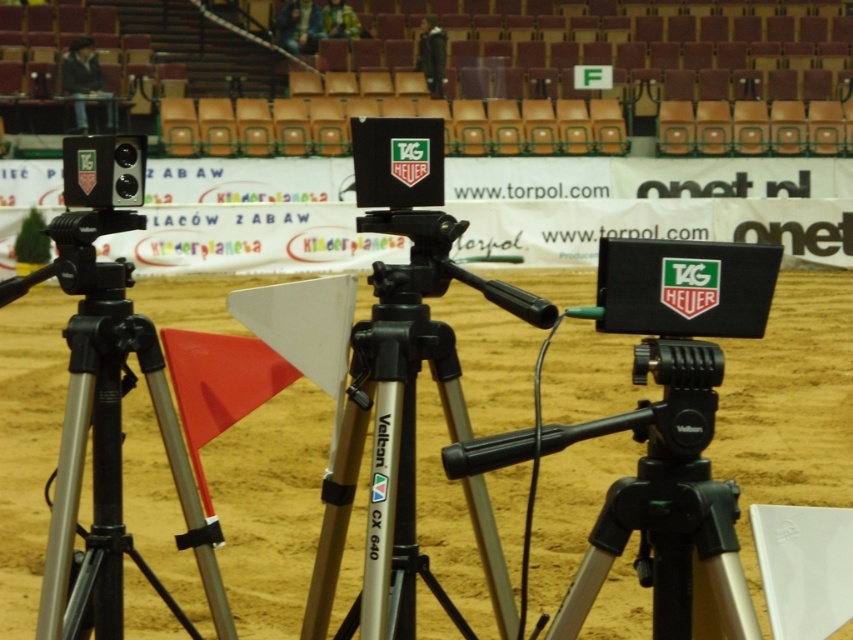
You are a technician setting up equipment in the arena. You need to place a new camera on the black metallic tripod at left so that its height matches the height of the brown sand at center. Is the tripod currently tall enough to achieve this?

The black metallic tripod at left is shorter than brown sand at center, so it cannot reach the required height. You need to adjust or replace the tripod to match the sand level.

You are a technician adjusting camera positions in the sports arena. You need to ensure that the black metallic tripod at center and the black metallic tripod at left are set up so that neither blocks the other. Based on their positions, which tripod should you adjust to avoid blocking the view?

The black metallic tripod at center is above the black metallic tripod at left, so adjusting the black metallic tripod at center downward or moving it slightly back would prevent it from blocking the view of the tripod at left.

You are a camera operator standing at the center of the arena. You need to adjust the focus of your camera to capture either the point at (367,224) or the point at (86,388). Which point should you focus on first if you want to capture the closest object?

You should focus on point (367,224) first because it is closer to you than point (86,388), as stated in the description.